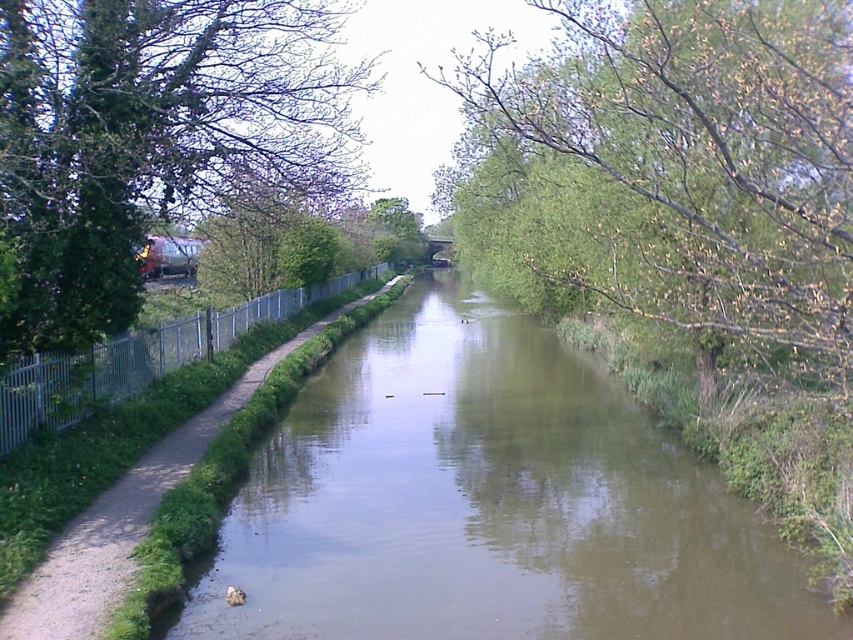
Question: Can you confirm if green smooth water at center is thinner than green leafy tree at center?

Choices:
 (A) yes
 (B) no

Answer: (B)

Question: Considering the real-world distances, which object is farthest from the green smooth water at center?

Choices:
 (A) green leafy tree at left
 (B) silver metallic fence at left

Answer: (A)

Question: Considering the relative positions of green smooth water at center and silver metallic fence at left in the image provided, where is green smooth water at center located with respect to silver metallic fence at left?

Choices:
 (A) right
 (B) left

Answer: (A)

Question: Which point is farther to the camera?

Choices:
 (A) (236, 340)
 (B) (218, 184)

Answer: (B)

Question: Observing the image, what is the correct spatial positioning of green leafy tree at center in reference to silver metallic fence at left?

Choices:
 (A) below
 (B) above

Answer: (B)

Question: Which of the following is the farthest from the observer?

Choices:
 (A) green leafy tree at left
 (B) silver metallic fence at left

Answer: (B)